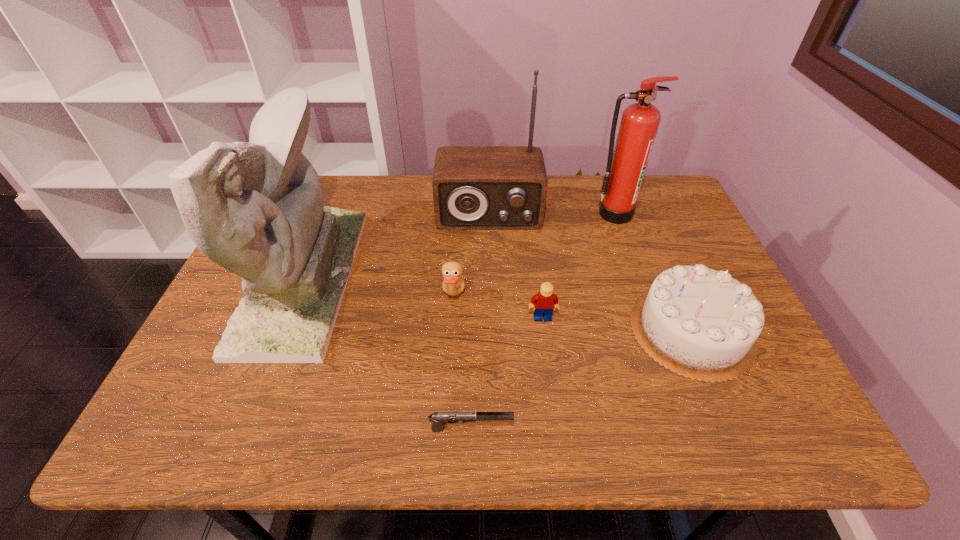
Find the location of `blank region between the Lego and the radio receiver`. blank region between the Lego and the radio receiver is located at coordinates (516, 266).

The height and width of the screenshot is (540, 960). Find the location of `free space between the radio receiver and the fire extinguisher`. free space between the radio receiver and the fire extinguisher is located at coordinates (552, 214).

Find the location of a particular element. This screenshot has height=540, width=960. vacant region between the birthday cake and the duck is located at coordinates (572, 313).

The image size is (960, 540). Find the location of `vacant space in between the shortest object and the Lego`. vacant space in between the shortest object and the Lego is located at coordinates (506, 373).

I want to click on free space that is in between the leftmost object and the duck, so click(x=378, y=287).

What are the coordinates of `free space between the nearest object and the duck` in the screenshot? It's located at (462, 362).

Identify the location of free space between the fourth shortest object and the duck. This screenshot has width=960, height=540. (572, 313).

Locate an element on the screen. free space between the birthday cake and the duck is located at coordinates (572, 313).

This screenshot has width=960, height=540. Identify the location of free space between the Lego and the fire extinguisher. (579, 266).

The image size is (960, 540). I want to click on object that is the third closest one to the birthday cake, so click(x=474, y=187).